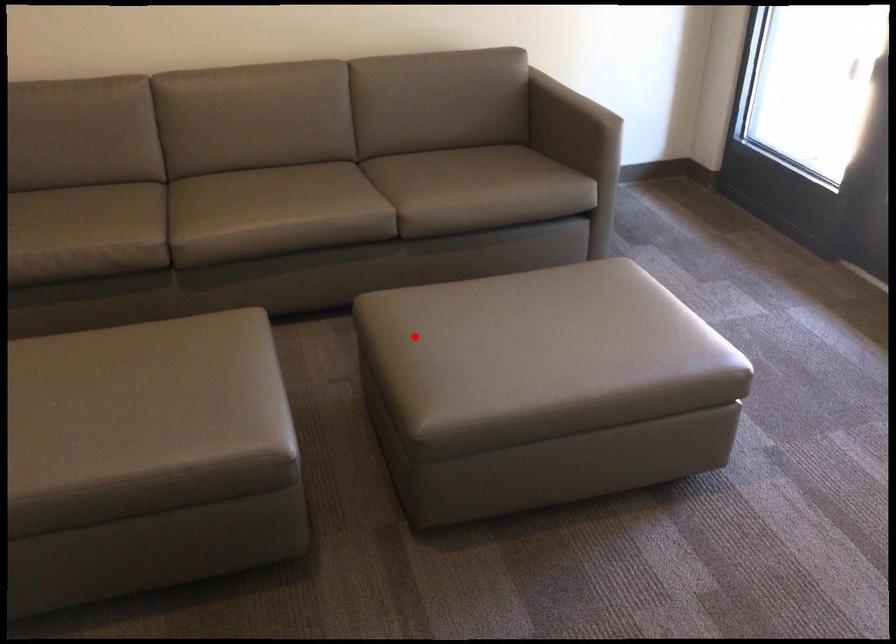
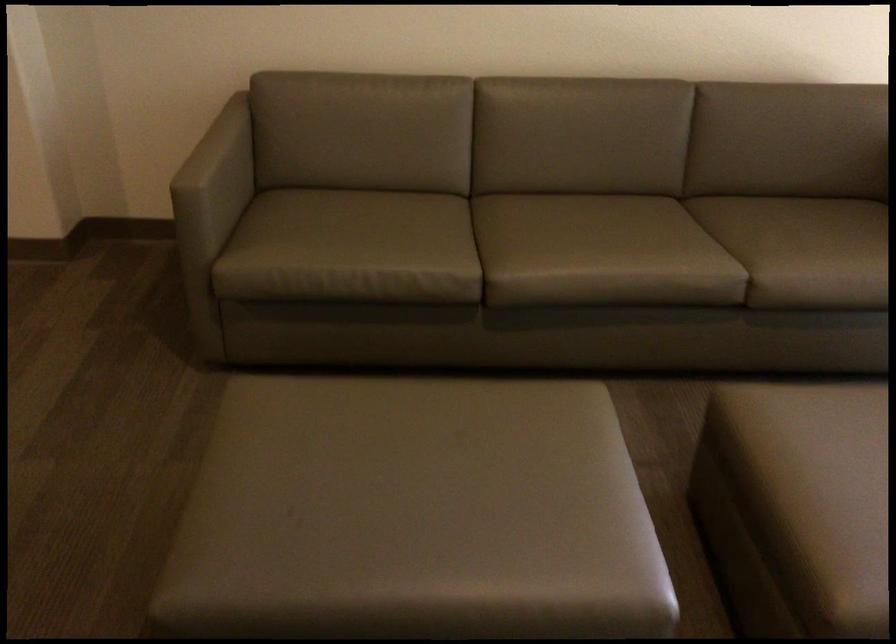
Question: I am providing you with two images of the same scene from different viewpoints. A red point is shown in image1. For the corresponding object point in image2, is it positioned nearer or farther from the camera?

Choices:
 (A) Nearer
 (B) Farther

Answer: (A)